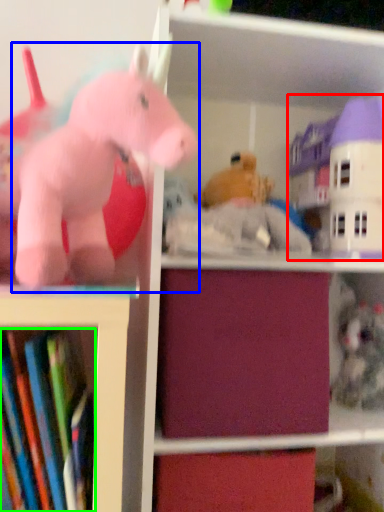
Question: Which object is the farthest from toy (highlighted by a red box)? Choose among these: toy (highlighted by a blue box) or book (highlighted by a green box).

Choices:
 (A) toy
 (B) book

Answer: (B)